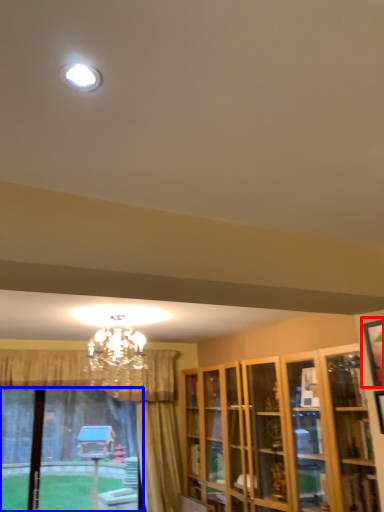
Question: Which point is further to the camera, picture frame (highlighted by a red box) or bay window (highlighted by a blue box)?

Choices:
 (A) picture frame
 (B) bay window

Answer: (B)